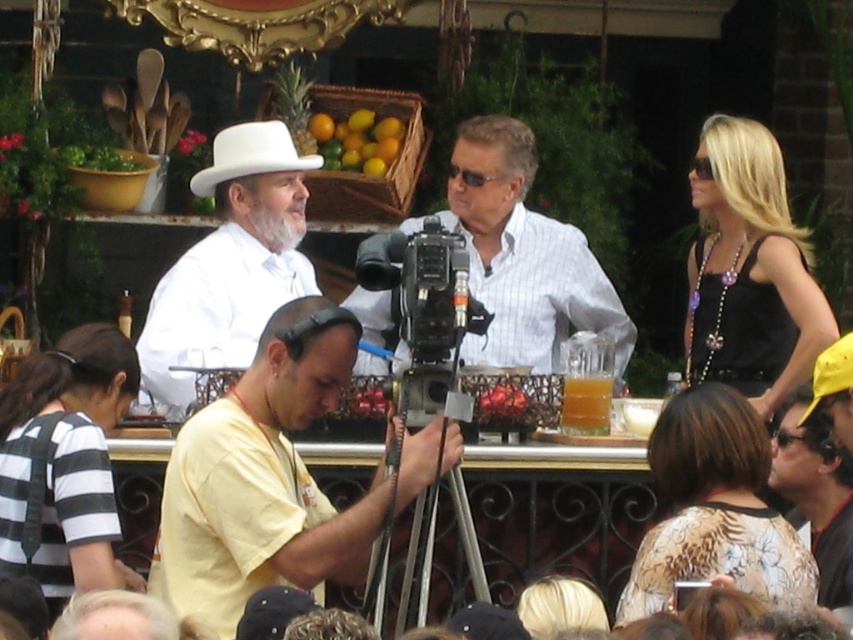
Question: Considering the relative positions of black plastic video camera at center and white matte cowboy hat at upper center in the image provided, where is black plastic video camera at center located with respect to white matte cowboy hat at upper center?

Choices:
 (A) right
 (B) left

Answer: (A)

Question: Does white matte hat at upper left come behind black plastic video camera at center?

Choices:
 (A) yes
 (B) no

Answer: (A)

Question: Which is nearer to the black plastic video camera at center?

Choices:
 (A) white matte hat at upper left
 (B) white matte cowboy hat at upper center

Answer: (A)

Question: From the image, what is the correct spatial relationship of yellow matte shirt at center in relation to white matte hat at upper left?

Choices:
 (A) above
 (B) below

Answer: (B)

Question: Which of these objects is positioned closest to the yellow matte shirt at center?

Choices:
 (A) black plastic video camera at center
 (B) translucent glass cup at center
 (C) silver metallic tripod at center
 (D) white matte cowboy hat at upper center

Answer: (C)

Question: Which object appears closest to the camera in this image?

Choices:
 (A) silver metallic tripod at center
 (B) translucent glass cup at center
 (C) white checkered shirt at center
 (D) yellow matte shirt at center

Answer: (D)